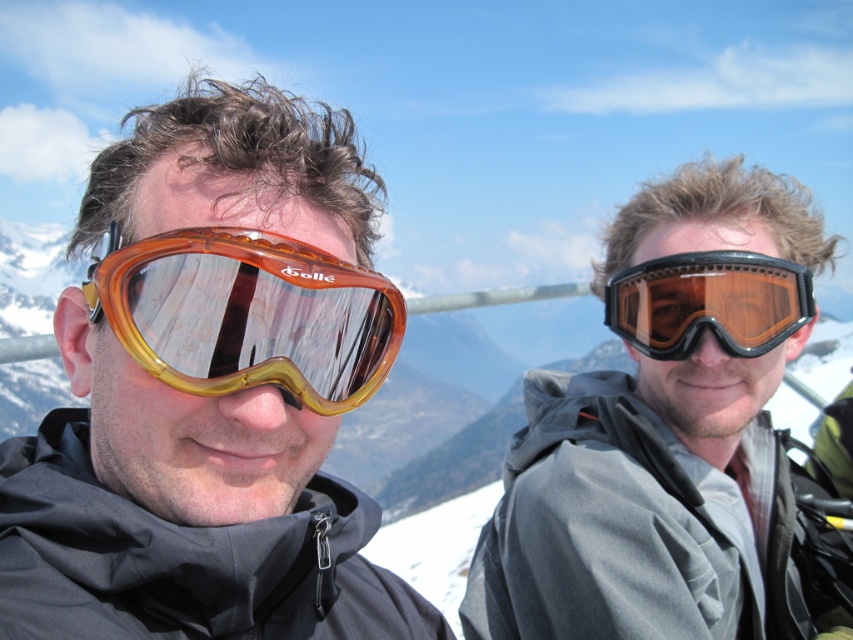
Question: Which object is closer to the camera taking this photo?

Choices:
 (A) matte black goggles at center
 (B) matte black goggles at right

Answer: (A)

Question: Which object is positioned farthest from the translucent amber plastic goggles at left?

Choices:
 (A) orange translucent goggles at center
 (B) matte black goggles at right
 (C) matte black goggles at center

Answer: (C)

Question: Can you confirm if translucent amber plastic goggles at left is bigger than matte black goggles at right?

Choices:
 (A) no
 (B) yes

Answer: (B)

Question: Is matte black goggles at center to the left of translucent amber plastic goggles at left from the viewer's perspective?

Choices:
 (A) no
 (B) yes

Answer: (A)

Question: Which of the following is the closest to the observer?

Choices:
 (A) matte black goggles at center
 (B) orange translucent goggles at center
 (C) matte black goggles at right

Answer: (B)

Question: Observing the image, what is the correct spatial positioning of matte black goggles at center in reference to translucent amber plastic goggles at left?

Choices:
 (A) right
 (B) left

Answer: (A)